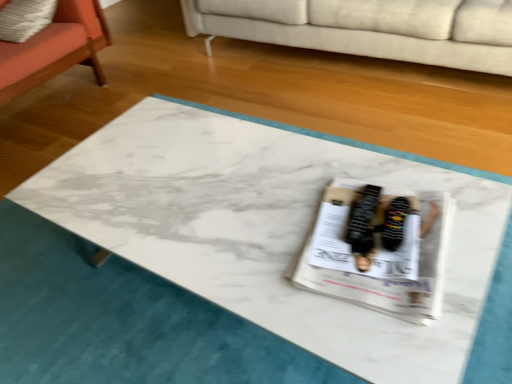
Question: Is beige fabric couch at upper center inside the boundaries of white glossy magazine at center, or outside?

Choices:
 (A) inside
 (B) outside

Answer: (B)

Question: Is point (499, 36) positioned closer to the camera than point (422, 316)?

Choices:
 (A) farther
 (B) closer

Answer: (A)

Question: Which object is positioned closest to the black suede sneakers at center?

Choices:
 (A) beige fabric couch at upper center
 (B) orange fabric chair at left
 (C) white glossy magazine at center

Answer: (C)

Question: Estimate the real-world distances between objects in this image. Which object is closer to the orange fabric chair at left?

Choices:
 (A) white glossy magazine at center
 (B) black suede sneakers at center
 (C) beige fabric couch at upper center

Answer: (C)